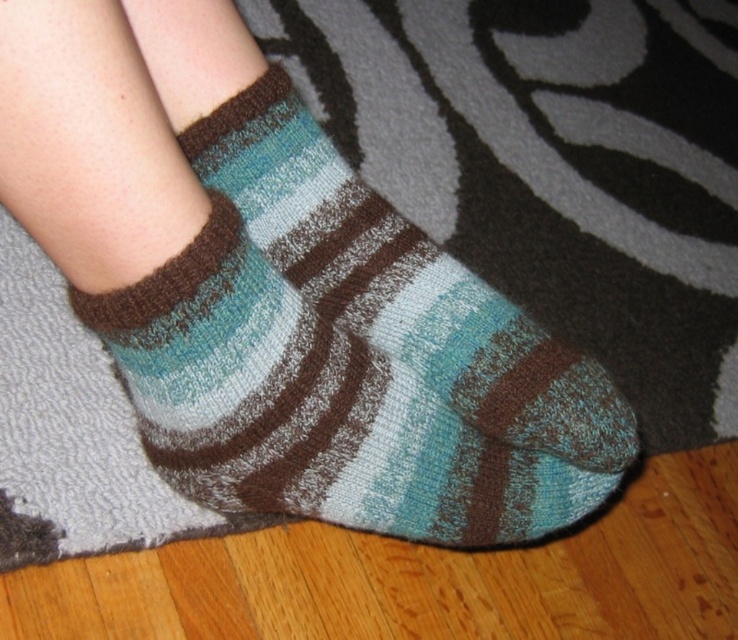
Does teal striped sock at lower center have a lesser height compared to teal knitted sock at center?

Correct, teal striped sock at lower center is not as tall as teal knitted sock at center.

Who is more distant from viewer, (351, 288) or (444, 266)?

The point (444, 266) is behind.

What do you see at coordinates (356, 380) in the screenshot? The width and height of the screenshot is (738, 640). I see `teal striped sock at lower center` at bounding box center [356, 380].

Identify the location of teal striped sock at lower center. (356, 380).